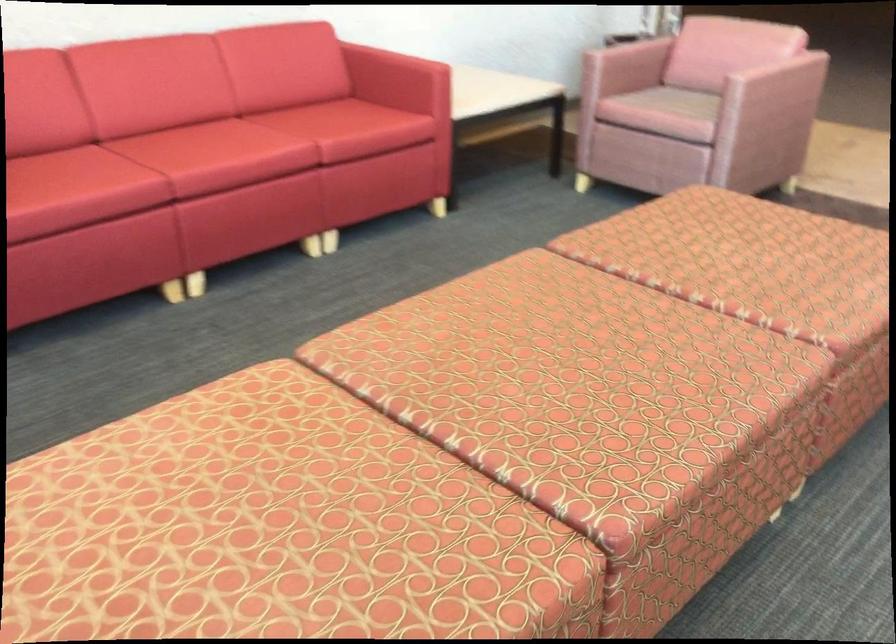
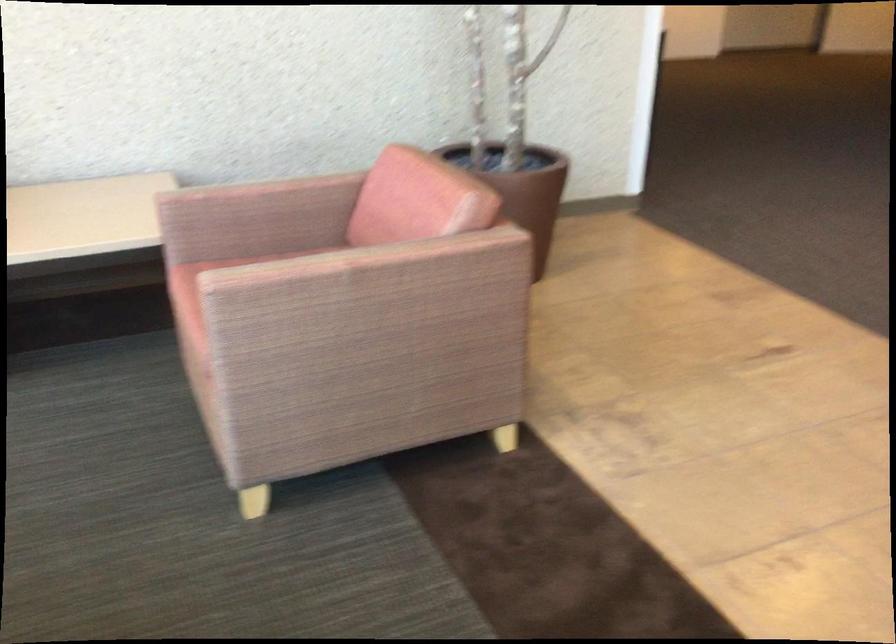
What movement of the cameraman would produce the second image?

The cameraman walked toward right, forward.